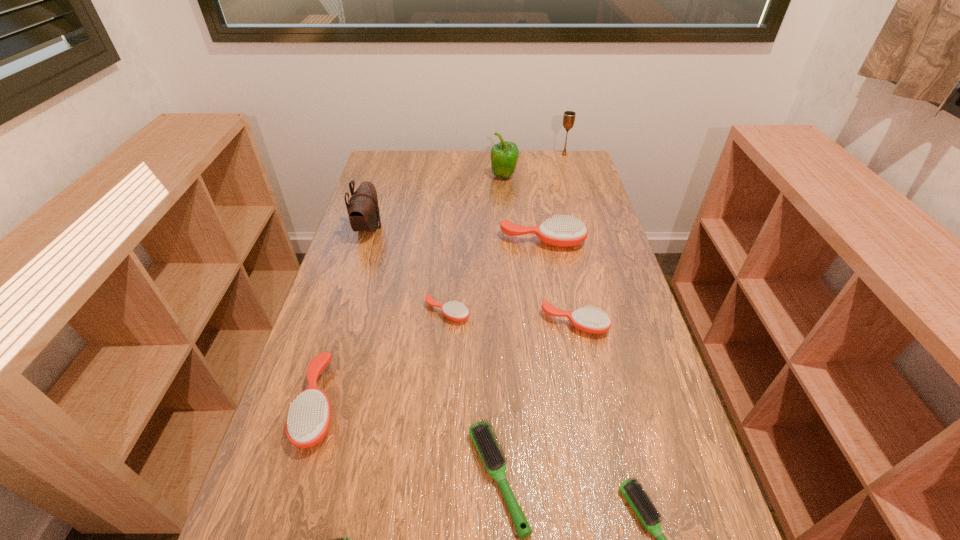
At what (x,y) coordinates should I click in order to perform the action: click on free point between the brown pouch and the third biggest orange hairbrush. Please return your answer as a coordinate pair (x, y). This screenshot has width=960, height=540. Looking at the image, I should click on (471, 275).

At what (x,y) coordinates should I click in order to perform the action: click on free point between the smallest orange hairbrush and the third tallest hairbrush. Please return your answer as a coordinate pair (x, y). Looking at the image, I should click on (512, 318).

I want to click on vacant area between the brown pouch and the second biggest orange hairbrush, so click(x=344, y=316).

Locate an element on the screen. Image resolution: width=960 pixels, height=540 pixels. vacant space that's between the pouch and the smallest orange hairbrush is located at coordinates (408, 270).

Where is `vacant space that's between the biggest orange hairbrush and the fourth object from left to right`? vacant space that's between the biggest orange hairbrush and the fourth object from left to right is located at coordinates (495, 277).

Point out which object is positioned as the ninth nearest to the brown pouch. Please provide its 2D coordinates. Your answer should be formatted as a tuple, i.e. [(x, y)], where the tuple contains the x and y coordinates of a point satisfying the conditions above.

[(641, 504)]

The width and height of the screenshot is (960, 540). What are the coordinates of `object that stands as the closest to the biggest orange hairbrush` in the screenshot? It's located at (456, 311).

Locate an element on the screen. The height and width of the screenshot is (540, 960). hairbrush that is the second closest to the brown pouch is located at coordinates (563, 231).

Identify which hairbrush is the second nearest to the farthest hairbrush. Please provide its 2D coordinates. Your answer should be formatted as a tuple, i.e. [(x, y)], where the tuple contains the x and y coordinates of a point satisfying the conditions above.

[(589, 320)]

Point out which orange hairbrush is positioned as the second nearest to the pouch. Please provide its 2D coordinates. Your answer should be formatted as a tuple, i.e. [(x, y)], where the tuple contains the x and y coordinates of a point satisfying the conditions above.

[(563, 231)]